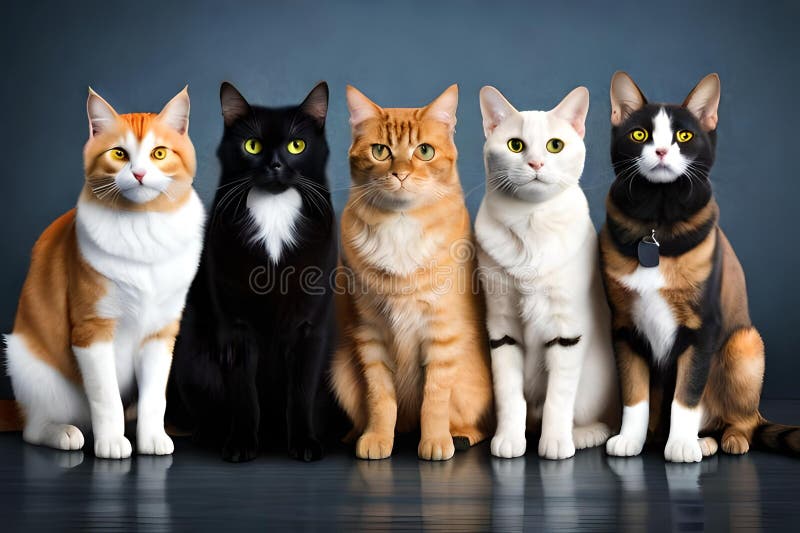
The width and height of the screenshot is (800, 533). I want to click on white fur, so click(134, 259), click(270, 232), click(402, 241), click(542, 228), click(662, 318).